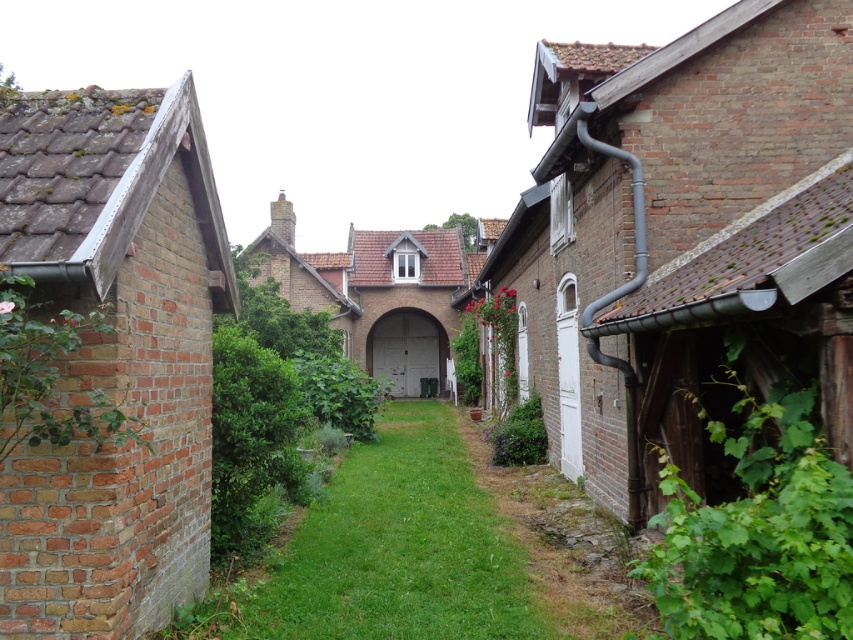
Question: Observing the image, what is the correct spatial positioning of green grass at center in reference to brown stone path at lower right?

Choices:
 (A) below
 (B) above

Answer: (B)

Question: Where is green grass at center located in relation to brown stone path at lower right in the image?

Choices:
 (A) below
 (B) above

Answer: (B)

Question: Which point is farther to the camera?

Choices:
 (A) brown stone path at lower right
 (B) green grass at center

Answer: (A)

Question: Does green grass at center appear under brown stone path at lower right?

Choices:
 (A) no
 (B) yes

Answer: (A)

Question: Which of the following is the closest to the observer?

Choices:
 (A) green grass at center
 (B) brown stone path at lower right

Answer: (A)

Question: Among these points, which one is farthest from the camera?

Choices:
 (A) (581, 563)
 (B) (293, 552)

Answer: (B)